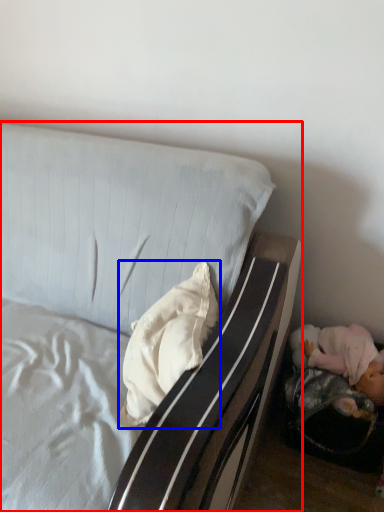
Question: Which of the following is the closest to the observer, bed (highlighted by a red box) or pillow (highlighted by a blue box)?

Choices:
 (A) bed
 (B) pillow

Answer: (A)